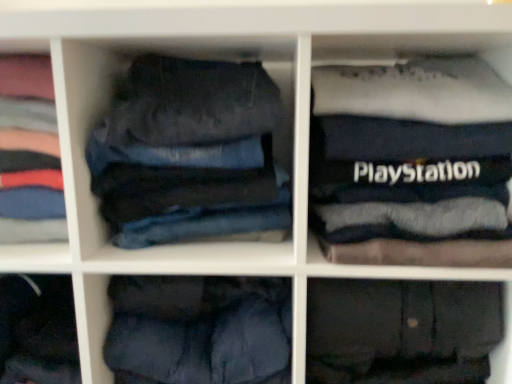
Question: Is dark blue denim jeans at left, the 2th clothing from the right, taller or shorter than denim jeans at center, which is counted as the 3th trousers, starting from the right?

Choices:
 (A) short
 (B) tall

Answer: (A)

Question: Is dark blue denim jeans at left, the 2th clothing from the right, inside the boundaries of denim jeans at center, which is counted as the 3th trousers, starting from the right, or outside?

Choices:
 (A) outside
 (B) inside

Answer: (A)

Question: Estimate the real-world distances between objects in this image. Which object is farther from the denim jeans at center, which is counted as the 3th trousers, starting from the right?

Choices:
 (A) dark blue cotton trousers at lower center, the second trousers positioned from the left
 (B) dark blue denim jeans at left, which is the first clothing in left-to-right order
 (C) black fabric playstation case at upper right, which is the 1th clothing from right to left
 (D) dark gray cotton trousers at lower right, the first trousers when ordered from right to left

Answer: (D)

Question: Which is nearer to the dark blue cotton trousers at lower center, the second trousers positioned from the left?

Choices:
 (A) black fabric playstation case at upper right, acting as the second clothing starting from the left
 (B) dark blue denim jeans at left, the 2th clothing from the right
 (C) dark gray cotton trousers at lower right, marked as the third trousers in a left-to-right arrangement
 (D) denim jeans at center, which is counted as the 3th trousers, starting from the right

Answer: (C)